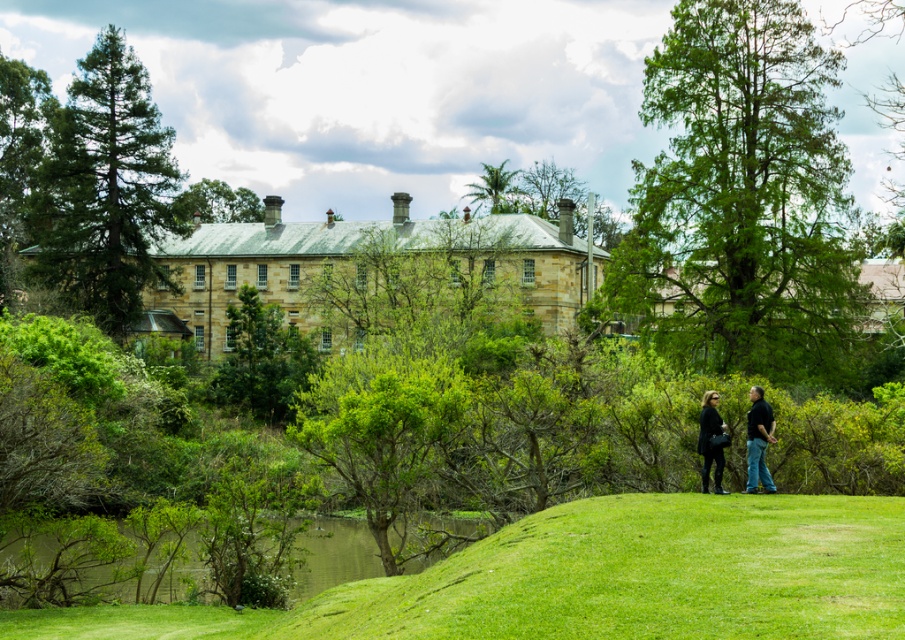
Question: Where is green grassy lawn at lower center located in relation to matte black pants at lower center in the image?

Choices:
 (A) above
 (B) below

Answer: (B)

Question: Does green leafy tree at upper right appear under green leafy palm tree at upper center?

Choices:
 (A) yes
 (B) no

Answer: (A)

Question: Which point appears closest to the camera in this image?

Choices:
 (A) (32, 172)
 (B) (749, 397)
 (C) (34, 186)
 (D) (749, 483)

Answer: (D)

Question: Which point is closer to the camera taking this photo?

Choices:
 (A) (472, 182)
 (B) (132, 168)

Answer: (B)

Question: Does green mossy pond at lower left lie behind matte black jacket at lower center?

Choices:
 (A) yes
 (B) no

Answer: (A)

Question: Which object appears farthest from the camera in this image?

Choices:
 (A) green mossy pond at lower left
 (B) green leafy tree at left
 (C) dark blue jeans at lower right

Answer: (B)